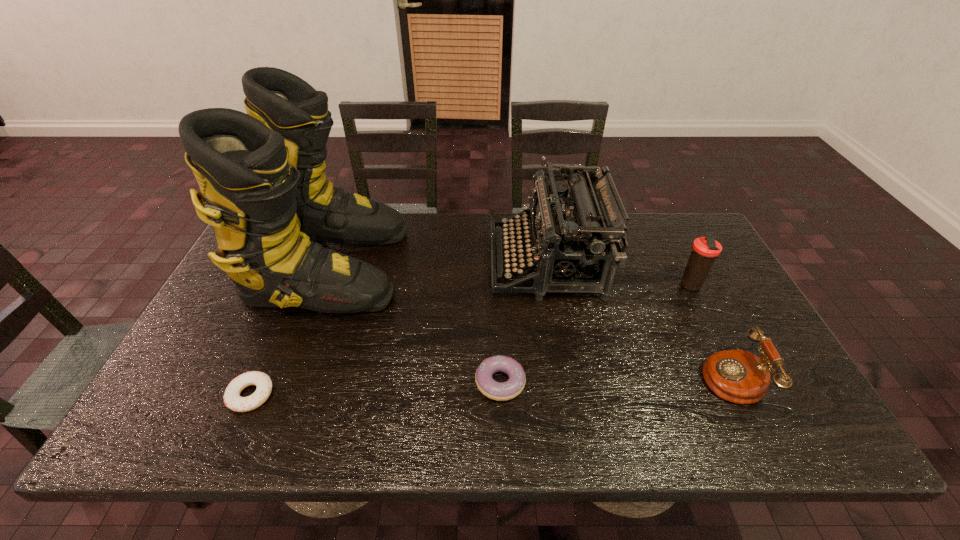
Find the location of a particular element. free point located 0.130m on the typing side of the typewriter is located at coordinates (448, 262).

The width and height of the screenshot is (960, 540). In order to click on vacant space located on the typing side of the typewriter in this screenshot , I will do `click(370, 262)`.

Identify the location of free region located on the back of the thermos bottle. (677, 261).

The height and width of the screenshot is (540, 960). I want to click on vacant space located on the dial of the telephone, so click(x=609, y=374).

Where is `blank space located 0.060m on the dial of the telephone`? blank space located 0.060m on the dial of the telephone is located at coordinates (676, 374).

The image size is (960, 540). Find the location of `blank space located on the dial of the telephone`. blank space located on the dial of the telephone is located at coordinates (647, 374).

You are a GUI agent. You are given a task and a screenshot of the screen. Output one action in this format:
    pyautogui.click(x=<x>, y=<y>)
    Task: Click on the blank area located 0.100m on the right of the fifth tallest object
    The height and width of the screenshot is (540, 960).
    Given the screenshot: What is the action you would take?
    pyautogui.click(x=567, y=382)

Where is `blank area located on the back of the shorter doughnut`? blank area located on the back of the shorter doughnut is located at coordinates (268, 356).

At what (x,y) coordinates should I click in order to perform the action: click on ski boots situated at the far edge. Please return your answer as a coordinate pair (x, y). The width and height of the screenshot is (960, 540). Looking at the image, I should click on (262, 177).

You are a GUI agent. You are given a task and a screenshot of the screen. Output one action in this format:
    pyautogui.click(x=<x>, y=<y>)
    Task: Click on the typewriter at the far edge
    This screenshot has height=540, width=960.
    Given the screenshot: What is the action you would take?
    pyautogui.click(x=582, y=245)